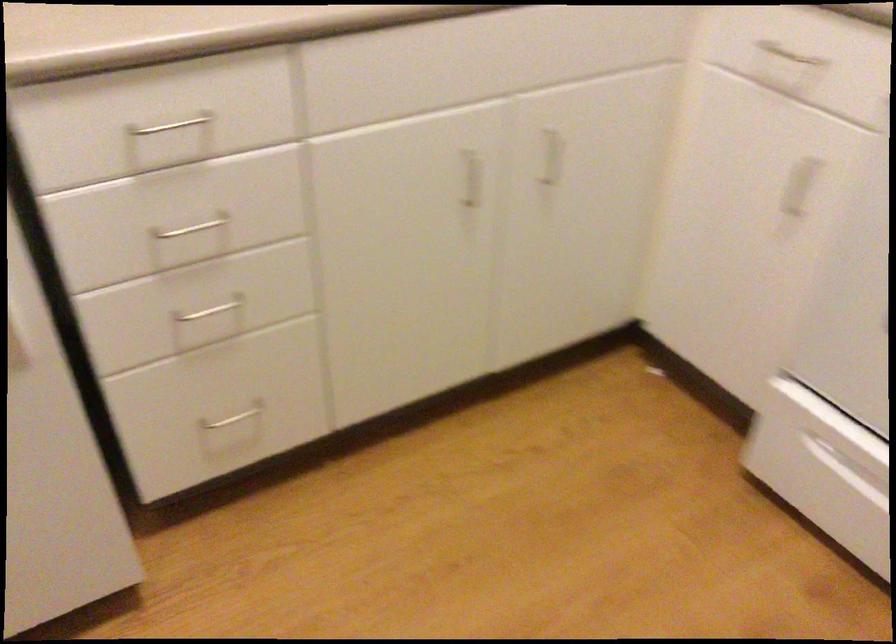
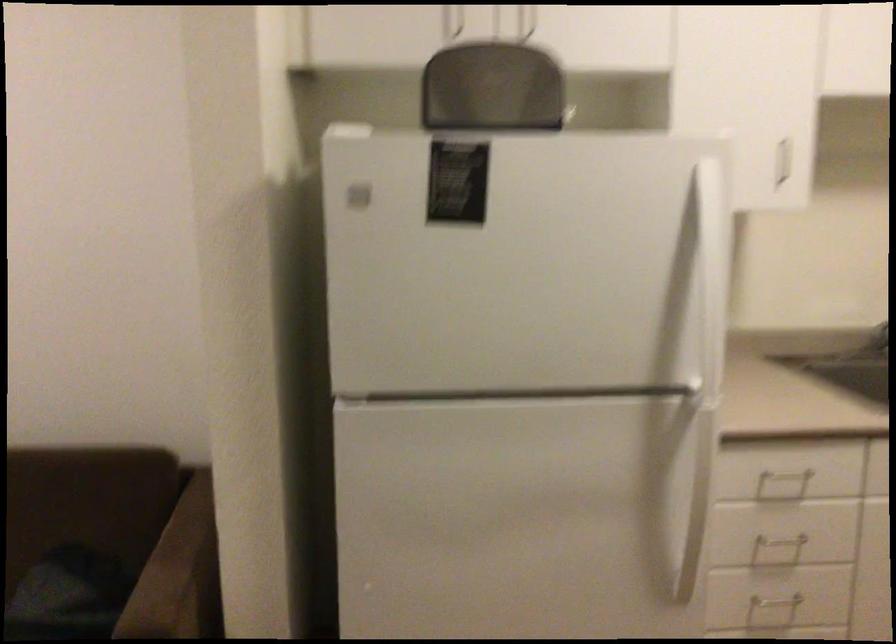
Where in the second image is the point corresponding to point (195, 234) from the first image?

(778, 547)